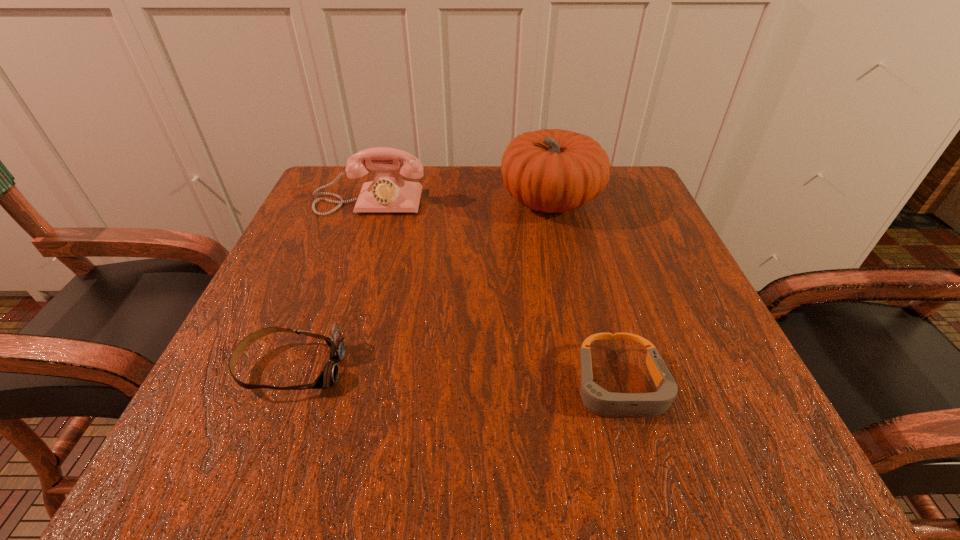
I want to click on telephone that is at the left edge, so click(x=388, y=192).

The image size is (960, 540). Find the location of `goggles that is at the left edge`. goggles that is at the left edge is located at coordinates (328, 377).

Image resolution: width=960 pixels, height=540 pixels. What are the coordinates of `pumpkin present at the right edge` in the screenshot? It's located at (551, 170).

I want to click on goggles positioned at the right edge, so click(x=596, y=399).

You are a GUI agent. You are given a task and a screenshot of the screen. Output one action in this format:
    pyautogui.click(x=<x>, y=<y>)
    Task: Click on the object at the far left corner
    This screenshot has height=540, width=960.
    Given the screenshot: What is the action you would take?
    pyautogui.click(x=388, y=192)

I want to click on object located at the far right corner, so click(551, 170).

Locate an element on the screen. The width and height of the screenshot is (960, 540). object positioned at the near right corner is located at coordinates (596, 399).

The height and width of the screenshot is (540, 960). What are the coordinates of `vacant space at the far edge of the desktop` in the screenshot? It's located at (386, 221).

Identify the location of vacant space at the near edge of the desktop. The image size is (960, 540). (575, 417).

Where is `vacant area at the left edge of the desktop`? vacant area at the left edge of the desktop is located at coordinates (282, 264).